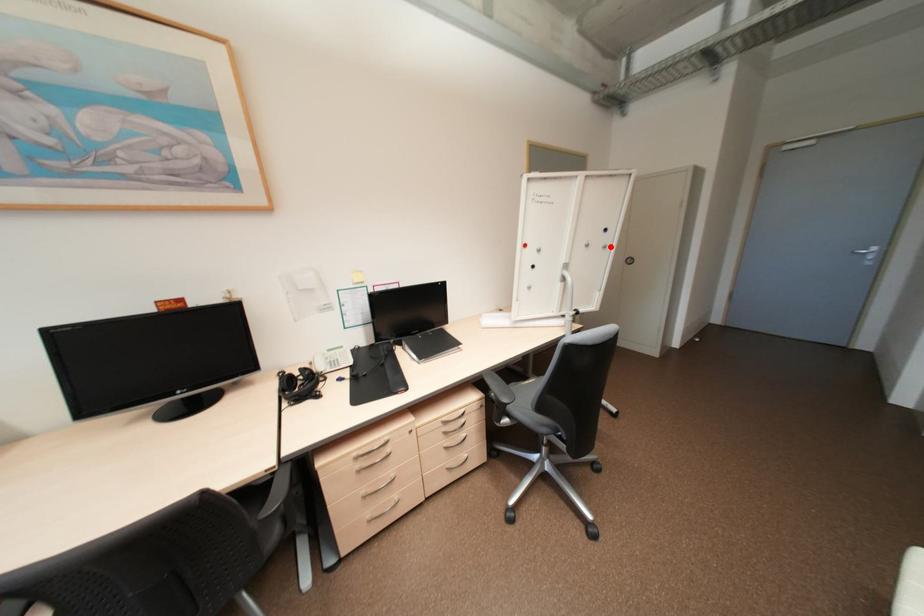
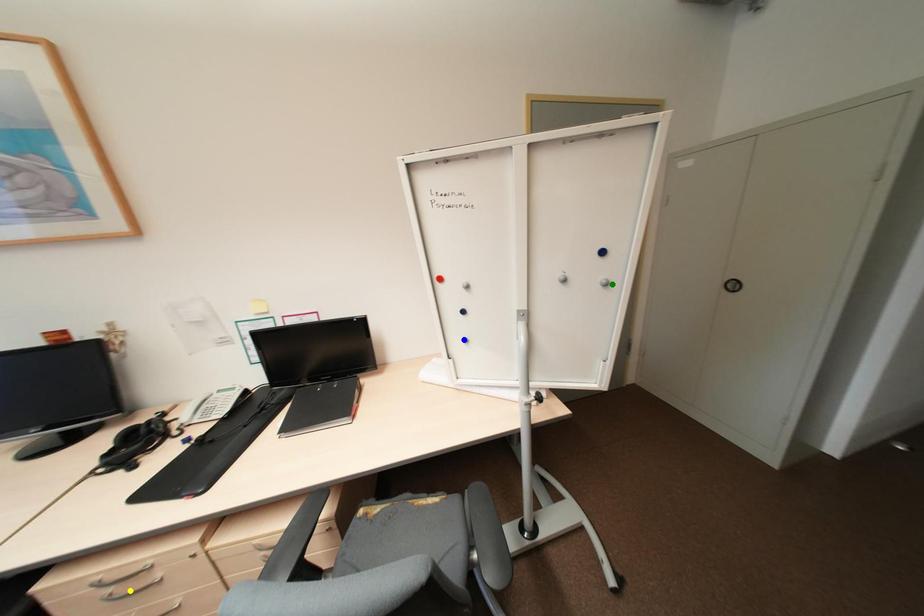
Question: I am providing you with two images of the same scene from different viewpoints. A red point is marked on the first image. You are given multiple points on the second image. Which spot in image 2 lines up with the point in image 1?

Choices:
 (A) blue point
 (B) green point
 (C) yellow point

Answer: (B)